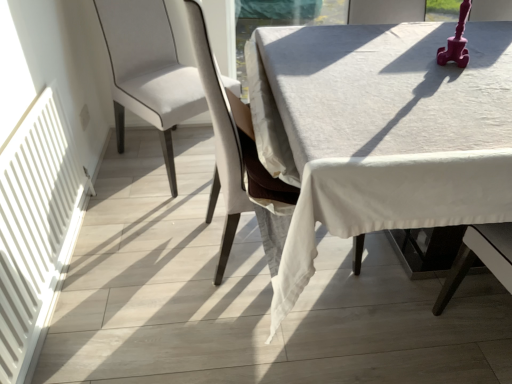
Question: Is white fabric chair at center, the 1th chair in the right-to-left sequence, outside white matte radiator at left?

Choices:
 (A) yes
 (B) no

Answer: (A)

Question: Would you consider white fabric chair at center, the 2th chair in the left-to-right sequence, to be distant from white matte radiator at left?

Choices:
 (A) no
 (B) yes

Answer: (A)

Question: Can you confirm if white fabric chair at center, the 1th chair in the right-to-left sequence, is positioned to the left of white matte radiator at left?

Choices:
 (A) no
 (B) yes

Answer: (A)

Question: Considering the relative sizes of white fabric chair at center, the 2th chair in the left-to-right sequence, and white matte radiator at left in the image provided, is white fabric chair at center, the 2th chair in the left-to-right sequence, smaller than white matte radiator at left?

Choices:
 (A) no
 (B) yes

Answer: (A)

Question: Does white fabric chair at center, the 1th chair in the right-to-left sequence, have a lesser height compared to white matte radiator at left?

Choices:
 (A) yes
 (B) no

Answer: (B)

Question: Can you confirm if white fabric chair at center, the 1th chair in the right-to-left sequence, is taller than white matte radiator at left?

Choices:
 (A) no
 (B) yes

Answer: (B)

Question: Is white matte radiator at left oriented towards white linen table at center?

Choices:
 (A) yes
 (B) no

Answer: (A)

Question: Considering the relative positions of white matte radiator at left and white linen table at center in the image provided, is white matte radiator at left to the left of white linen table at center from the viewer's perspective?

Choices:
 (A) no
 (B) yes

Answer: (B)

Question: From a real-world perspective, is white matte radiator at left beneath white linen table at center?

Choices:
 (A) yes
 (B) no

Answer: (A)

Question: Is white matte radiator at left shorter than white linen table at center?

Choices:
 (A) yes
 (B) no

Answer: (A)

Question: From the image's perspective, is white matte radiator at left above white linen table at center?

Choices:
 (A) yes
 (B) no

Answer: (B)

Question: Considering the relative sizes of white matte radiator at left and white linen table at center in the image provided, is white matte radiator at left wider than white linen table at center?

Choices:
 (A) no
 (B) yes

Answer: (A)

Question: Are white fabric chair at center, the 1th chair in the right-to-left sequence, and white linen table at center making contact?

Choices:
 (A) yes
 (B) no

Answer: (B)